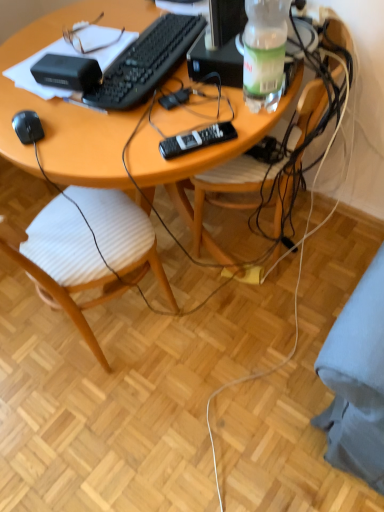
Image resolution: width=384 pixels, height=512 pixels. I want to click on empty space that is to the right of wooden chair at center, marked as the first chair in a left-to-right arrangement, so click(209, 314).